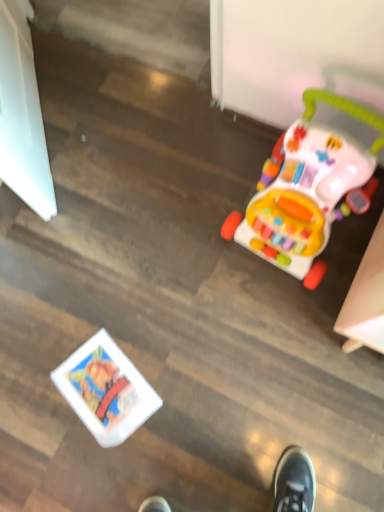
Find the location of a particular element. The width and height of the screenshot is (384, 512). empty space that is to the right of white glossy book at lower left, the 1th toy from the bottom is located at coordinates (184, 368).